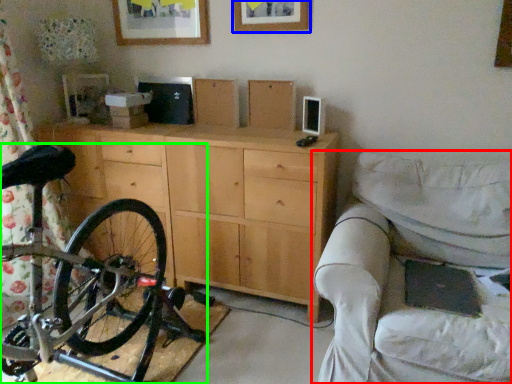
Question: Which object is the closest to the studio couch (highlighted by a red box)? Choose among these: picture frame (highlighted by a blue box) or bicycle (highlighted by a green box).

Choices:
 (A) picture frame
 (B) bicycle

Answer: (B)